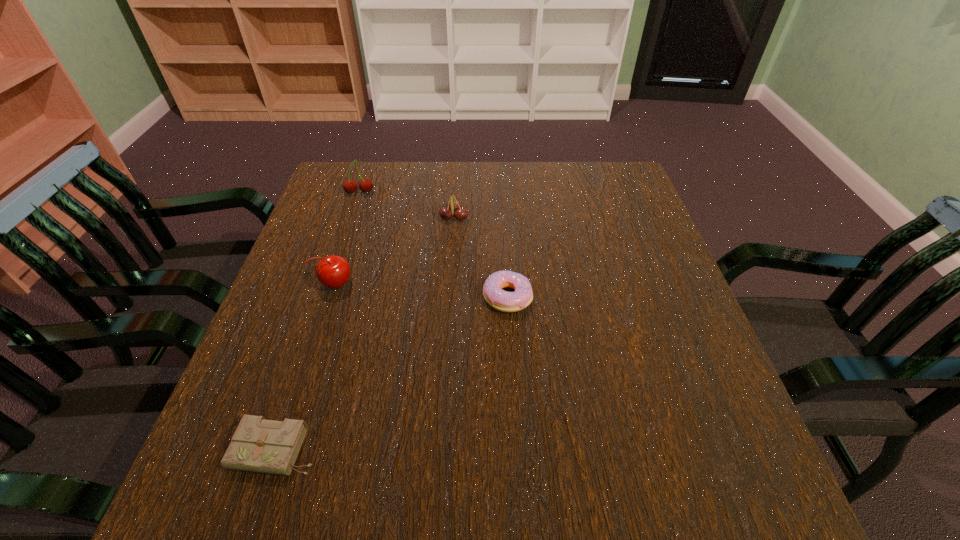
Image resolution: width=960 pixels, height=540 pixels. I want to click on vacant region that satisfies the following two spatial constraints: 1. on the surface of the farthest object; 2. on the left side of the rightmost object, so click(x=324, y=297).

You are a GUI agent. You are given a task and a screenshot of the screen. Output one action in this format:
    pyautogui.click(x=<x>, y=<y>)
    Task: Click on the free location that satisfies the following two spatial constraints: 1. on the back side of the nearest cherry; 2. on the right side of the nearest object
    
    Given the screenshot: What is the action you would take?
    pyautogui.click(x=331, y=284)

Locate an element on the screen. free region that satisfies the following two spatial constraints: 1. on the surface of the diary; 2. on the right side of the farthest object is located at coordinates (273, 449).